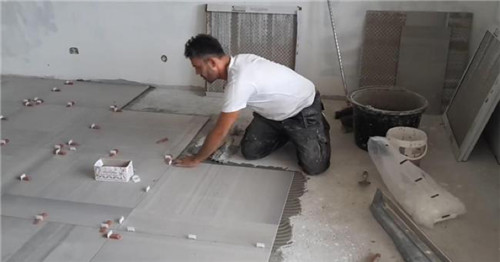
Where is `box`? box is located at coordinates (110, 180).